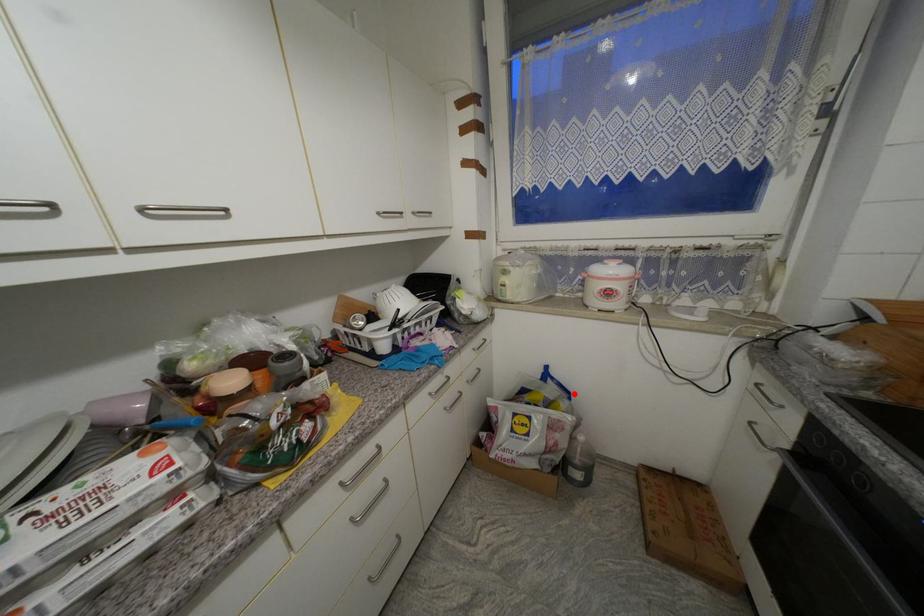
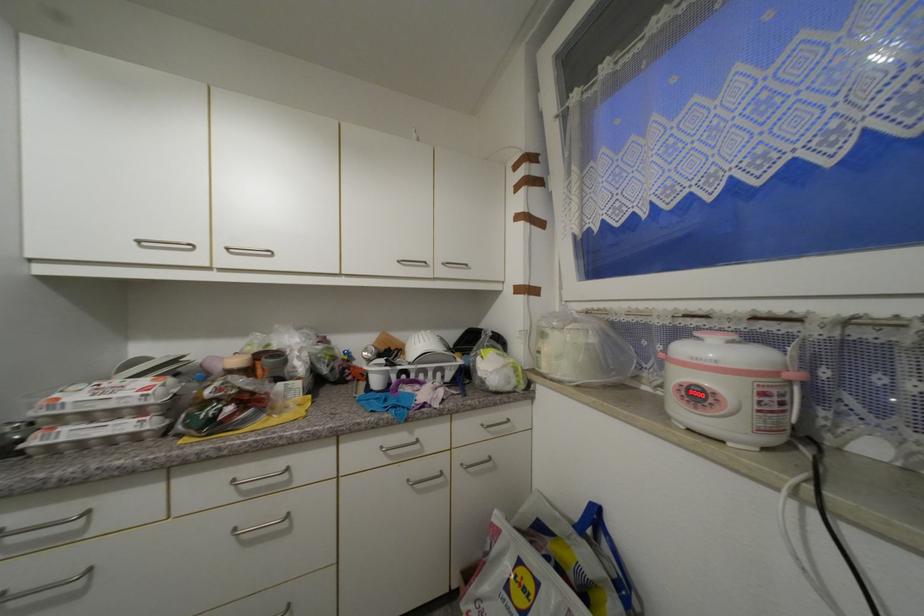
Where in the second image is the point corresponding to the highlighted location from the first image?

(636, 588)